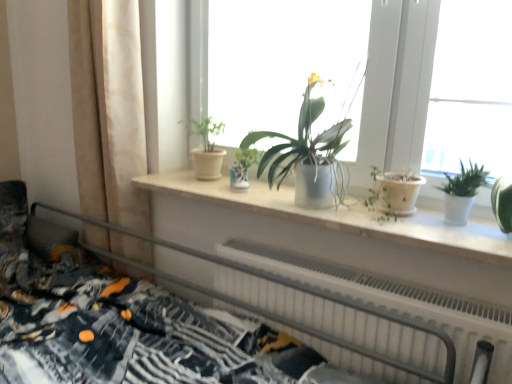
Question: Can you confirm if matte white windowsill at center is smaller than matte white pot at center, marked as the 3th houseplant in a right-to-left arrangement?

Choices:
 (A) yes
 (B) no

Answer: (B)

Question: Is matte white windowsill at center positioned beyond the bounds of matte white pot at center, the 1th houseplant from the left?

Choices:
 (A) no
 (B) yes

Answer: (B)

Question: Is matte white pot at center, marked as the 3th houseplant in a right-to-left arrangement, at the back of matte white windowsill at center?

Choices:
 (A) yes
 (B) no

Answer: (A)

Question: Considering the relative sizes of matte white windowsill at center and matte white pot at center, marked as the 3th houseplant in a right-to-left arrangement, in the image provided, is matte white windowsill at center bigger than matte white pot at center, marked as the 3th houseplant in a right-to-left arrangement,?

Choices:
 (A) yes
 (B) no

Answer: (A)

Question: Can you confirm if matte white windowsill at center is positioned to the right of matte white pot at center, marked as the 3th houseplant in a right-to-left arrangement?

Choices:
 (A) no
 (B) yes

Answer: (B)

Question: Is matte white windowsill at center in front of matte white pot at center, the 1th houseplant from the left?

Choices:
 (A) no
 (B) yes

Answer: (B)

Question: Is white matte window sill at center thinner than matte white windowsill at center?

Choices:
 (A) yes
 (B) no

Answer: (B)

Question: Can you confirm if white matte window sill at center is taller than matte white windowsill at center?

Choices:
 (A) no
 (B) yes

Answer: (A)

Question: Does white matte window sill at center appear on the left side of matte white windowsill at center?

Choices:
 (A) yes
 (B) no

Answer: (A)

Question: Is white matte window sill at center shorter than matte white windowsill at center?

Choices:
 (A) no
 (B) yes

Answer: (B)

Question: Considering the relative sizes of white matte window sill at center and matte white windowsill at center in the image provided, is white matte window sill at center bigger than matte white windowsill at center?

Choices:
 (A) no
 (B) yes

Answer: (A)

Question: From a real-world perspective, is white matte window sill at center positioned under matte white windowsill at center based on gravity?

Choices:
 (A) no
 (B) yes

Answer: (B)

Question: Does white matte window sill at center appear on the left side of matte silver pot at center, the second houseplant viewed from the left?

Choices:
 (A) no
 (B) yes

Answer: (B)